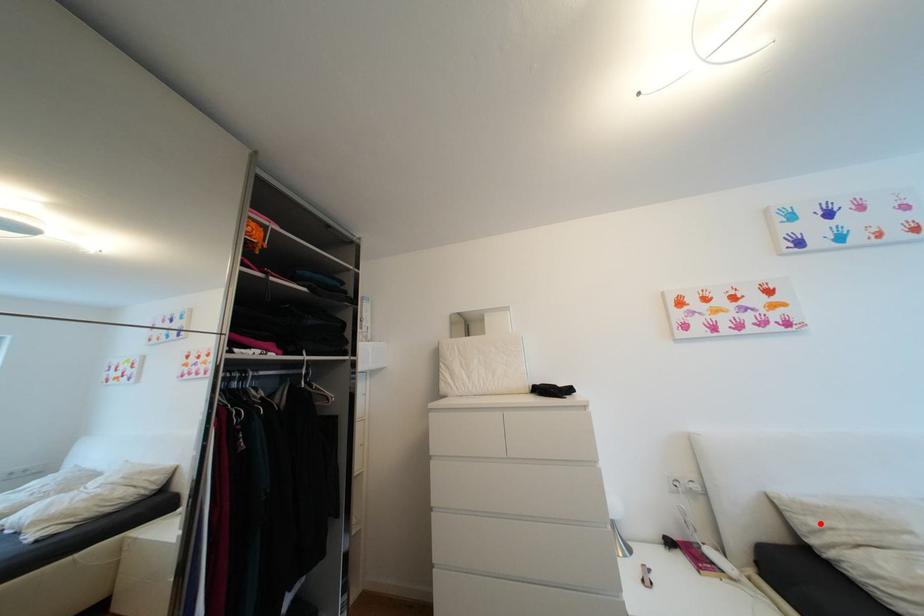
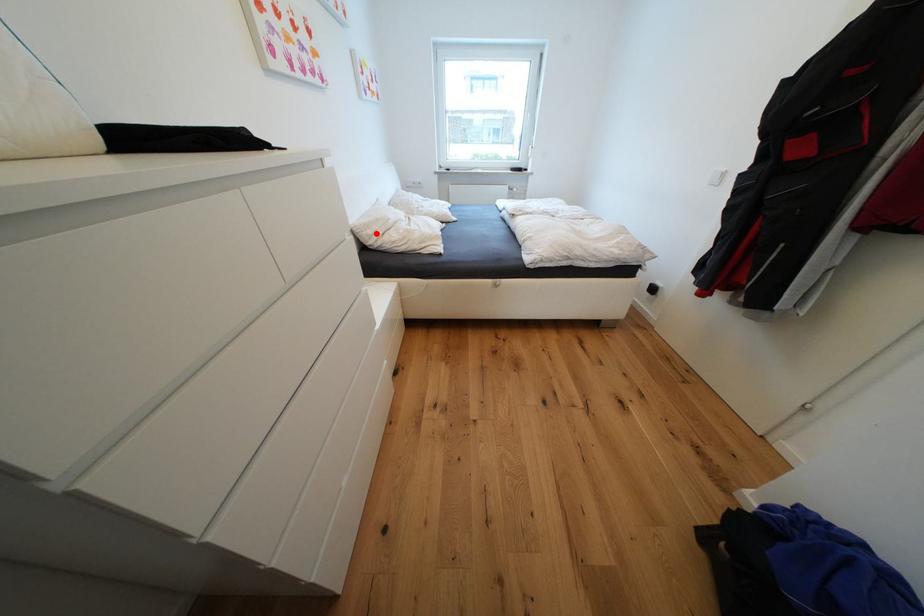
I am providing you with two images of the same scene from different viewpoints. A red point is marked on the first image and another point is marked on the second image. Is the red point in image1 aligned with the point shown in image2?

Yes